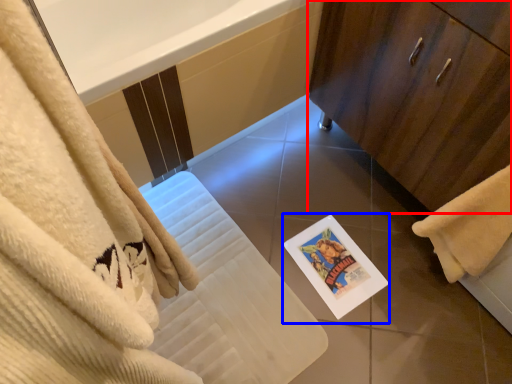
Question: Which point is closer to the camera, bathroom cabinet (highlighted by a red box) or postcard (highlighted by a blue box)?

Choices:
 (A) bathroom cabinet
 (B) postcard

Answer: (A)